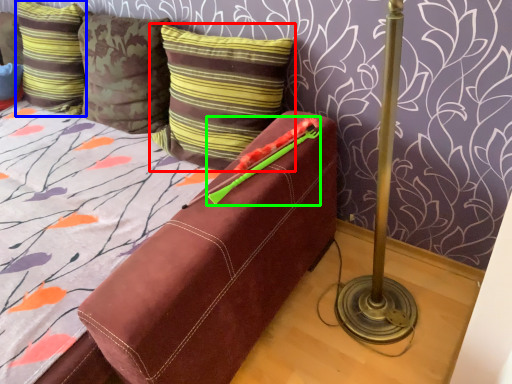
Question: Which object is the farthest from pillow (highlighted by a red box)? Choose among these: pillow (highlighted by a blue box) or crayon (highlighted by a green box).

Choices:
 (A) pillow
 (B) crayon

Answer: (A)